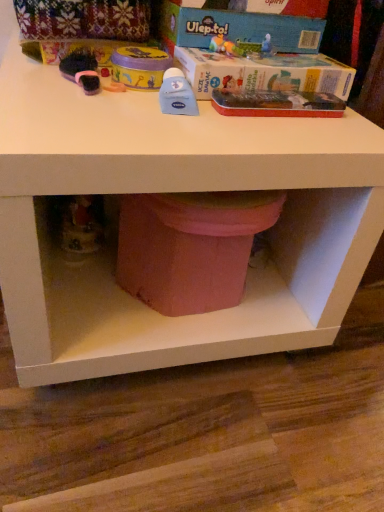
Where is `blue cardboard box at upper center, which ranks as the 1th box in top-to-bottom order`? The width and height of the screenshot is (384, 512). blue cardboard box at upper center, which ranks as the 1th box in top-to-bottom order is located at coordinates (239, 28).

The image size is (384, 512). What are the coordinates of `blue cardboard box at upper center, acting as the first box starting from the bottom` in the screenshot? It's located at (263, 73).

Is blue cardboard box at upper center, which ranks as the 1th box in top-to-bottom order, taller or shorter than matte pink potty at lower center?

In the image, blue cardboard box at upper center, which ranks as the 1th box in top-to-bottom order, appears to be shorter than matte pink potty at lower center.

You are a GUI agent. You are given a task and a screenshot of the screen. Output one action in this format:
    pyautogui.click(x=<x>, y=<y>)
    Task: Click on the potty that appears in front of the blue cardboard box at upper center, which ranks as the 1th box in top-to-bottom order
    
    Given the screenshot: What is the action you would take?
    pyautogui.click(x=190, y=247)

Does blue cardboard box at upper center, which ranks as the 1th box in top-to-bottom order, touch matte pink potty at lower center?

No, blue cardboard box at upper center, which ranks as the 1th box in top-to-bottom order, is not beside matte pink potty at lower center.

Is point (205, 37) farther from viewer compared to point (179, 243)?

Yes, it is.

From the image's perspective, is matte pink potty at lower center under blue cardboard box at upper center, which ranks as the 2th box in bottom-to-top order?

Yes.

Is the depth of matte pink potty at lower center greater than that of blue cardboard box at upper center, which ranks as the 1th box in top-to-bottom order?

No, matte pink potty at lower center is closer to the viewer.

From their relative heights in the image, would you say matte pink potty at lower center is taller or shorter than blue cardboard box at upper center, which ranks as the 2th box in bottom-to-top order?

Considering their sizes, matte pink potty at lower center has more height than blue cardboard box at upper center, which ranks as the 2th box in bottom-to-top order.

Which is correct: blue cardboard box at upper center, the 2th box viewed from the top, is inside matte pink potty at lower center, or outside of it?

blue cardboard box at upper center, the 2th box viewed from the top, is not inside matte pink potty at lower center, it's outside.

Is blue cardboard box at upper center, acting as the first box starting from the bottom, turned away from matte pink potty at lower center?

blue cardboard box at upper center, acting as the first box starting from the bottom, does not have its back to matte pink potty at lower center.

Who is more distant, blue cardboard box at upper center, acting as the first box starting from the bottom, or matte pink potty at lower center?

blue cardboard box at upper center, acting as the first box starting from the bottom, is further from the camera.

From the image's perspective, which object appears higher, blue cardboard box at upper center, the 2th box viewed from the top, or matte pink potty at lower center?

From the image's view, blue cardboard box at upper center, the 2th box viewed from the top, is above.

Is blue cardboard box at upper center, the 2th box viewed from the top, not within blue cardboard box at upper center, which ranks as the 2th box in bottom-to-top order?

blue cardboard box at upper center, the 2th box viewed from the top, lies outside blue cardboard box at upper center, which ranks as the 2th box in bottom-to-top order,'s area.

From the image's perspective, is blue cardboard box at upper center, the 2th box viewed from the top, beneath blue cardboard box at upper center, which ranks as the 1th box in top-to-bottom order?

Yes.

Is blue cardboard box at upper center, acting as the first box starting from the bottom, wider than blue cardboard box at upper center, which ranks as the 1th box in top-to-bottom order?

Yes.

From a real-world perspective, is matte pink potty at lower center on blue cardboard box at upper center, the 2th box viewed from the top?

No, from a real-world perspective, matte pink potty at lower center is not above blue cardboard box at upper center, the 2th box viewed from the top.

Does point (154, 266) lie in front of point (246, 84)?

That is False.

From the image's perspective, is blue cardboard box at upper center, which ranks as the 1th box in top-to-bottom order, located above blue cardboard box at upper center, the 2th box viewed from the top?

Yes, from the image's perspective, blue cardboard box at upper center, which ranks as the 1th box in top-to-bottom order, is over blue cardboard box at upper center, the 2th box viewed from the top.

Can you tell me how much blue cardboard box at upper center, which ranks as the 1th box in top-to-bottom order, and blue cardboard box at upper center, acting as the first box starting from the bottom, differ in facing direction?

blue cardboard box at upper center, which ranks as the 1th box in top-to-bottom order, and blue cardboard box at upper center, acting as the first box starting from the bottom, are facing 3.92 degrees away from each other.

Measure the distance between blue cardboard box at upper center, which ranks as the 2th box in bottom-to-top order, and blue cardboard box at upper center, acting as the first box starting from the bottom.

blue cardboard box at upper center, which ranks as the 2th box in bottom-to-top order, and blue cardboard box at upper center, acting as the first box starting from the bottom, are 2.65 inches apart from each other.

Is blue cardboard box at upper center, which ranks as the 2th box in bottom-to-top order, thinner than blue cardboard box at upper center, the 2th box viewed from the top?

Indeed, blue cardboard box at upper center, which ranks as the 2th box in bottom-to-top order, has a lesser width compared to blue cardboard box at upper center, the 2th box viewed from the top.

The height and width of the screenshot is (512, 384). Identify the location of the 2nd box positioned above the matte pink potty at lower center (from the image's perspective). (239, 28).

Locate an element on the screen. The width and height of the screenshot is (384, 512). potty lying below the blue cardboard box at upper center, which ranks as the 2th box in bottom-to-top order (from the image's perspective) is located at coordinates (190, 247).

Looking at the image, which one is located closer to blue cardboard box at upper center, which ranks as the 1th box in top-to-bottom order, blue cardboard box at upper center, the 2th box viewed from the top, or matte pink potty at lower center?

The object closer to blue cardboard box at upper center, which ranks as the 1th box in top-to-bottom order, is blue cardboard box at upper center, the 2th box viewed from the top.

Looking at the image, which one is located further to matte pink potty at lower center, blue cardboard box at upper center, acting as the first box starting from the bottom, or blue cardboard box at upper center, which ranks as the 1th box in top-to-bottom order?

blue cardboard box at upper center, which ranks as the 1th box in top-to-bottom order, lies further to matte pink potty at lower center than the other object.

Based on their spatial positions, is blue cardboard box at upper center, which ranks as the 1th box in top-to-bottom order, or matte pink potty at lower center closer to blue cardboard box at upper center, acting as the first box starting from the bottom?

The object closer to blue cardboard box at upper center, acting as the first box starting from the bottom, is blue cardboard box at upper center, which ranks as the 1th box in top-to-bottom order.

Which object lies further to the anchor point matte pink potty at lower center, blue cardboard box at upper center, which ranks as the 1th box in top-to-bottom order, or blue cardboard box at upper center, the 2th box viewed from the top?

blue cardboard box at upper center, which ranks as the 1th box in top-to-bottom order, lies further to matte pink potty at lower center than the other object.

Which object lies further to the anchor point blue cardboard box at upper center, which ranks as the 2th box in bottom-to-top order, matte pink potty at lower center or blue cardboard box at upper center, the 2th box viewed from the top?

The object further to blue cardboard box at upper center, which ranks as the 2th box in bottom-to-top order, is matte pink potty at lower center.

Considering their positions, is matte pink potty at lower center positioned closer to blue cardboard box at upper center, acting as the first box starting from the bottom, than blue cardboard box at upper center, which ranks as the 1th box in top-to-bottom order?

Based on the image, blue cardboard box at upper center, which ranks as the 1th box in top-to-bottom order, appears to be nearer to blue cardboard box at upper center, acting as the first box starting from the bottom.

The width and height of the screenshot is (384, 512). What are the coordinates of `box between blue cardboard box at upper center, which ranks as the 2th box in bottom-to-top order, and matte pink potty at lower center, in the vertical direction` in the screenshot? It's located at (263, 73).